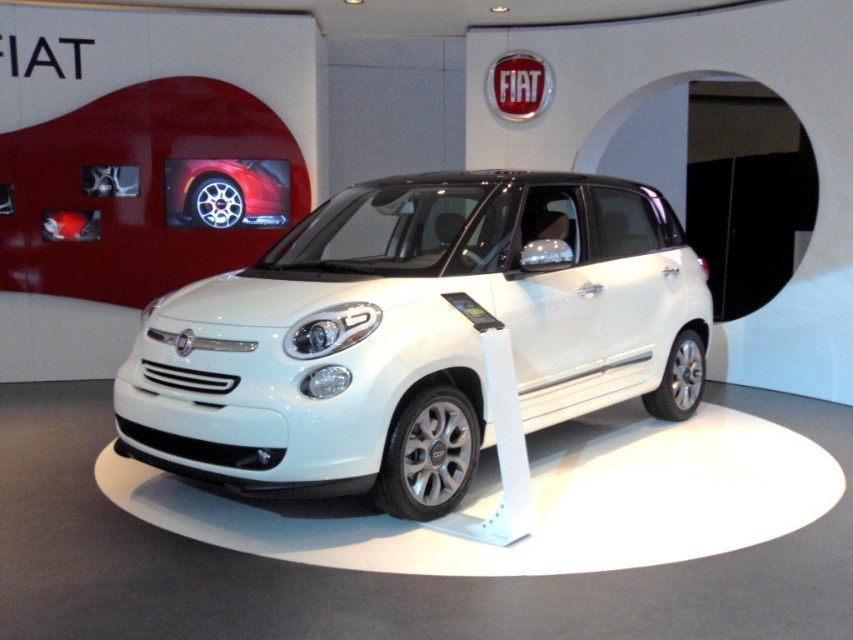
Question: Can you confirm if white metallic car at center is positioned above shiny silver rim at center?

Choices:
 (A) yes
 (B) no

Answer: (B)

Question: Is white metallic car at center above shiny silver rim at center?

Choices:
 (A) no
 (B) yes

Answer: (A)

Question: Does white metallic car at center have a smaller size compared to shiny silver rim at center?

Choices:
 (A) yes
 (B) no

Answer: (B)